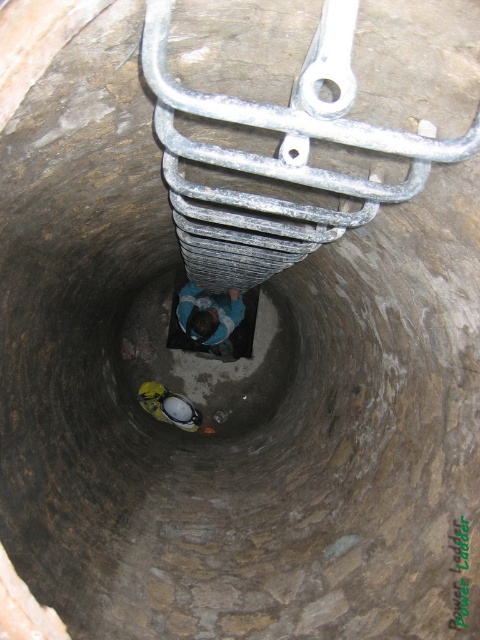
You are a safety inspector checking the well. You notice the smooth concrete hole at center and the blue fabric shirt at center. Which object has a greater width according to the description?

The smooth concrete hole at center has a greater width than the blue fabric shirt at center.

You are standing at the entrance of the well and need to reach the bottom. The galvanized metal ladder at center is your only path. Can you safely descend the ladder to reach the bottom?

Yes, you can safely descend the galvanized metal ladder at center to reach the bottom as it is positioned centrally and provides a stable path.